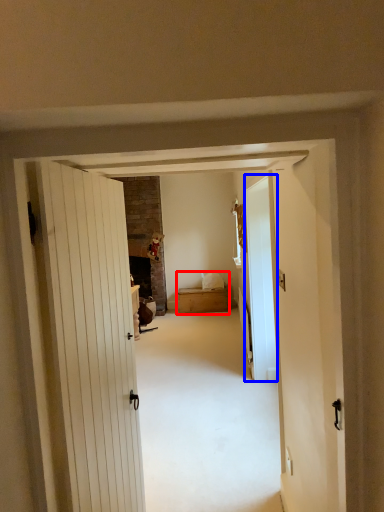
Question: Among these objects, which one is farthest to the camera, bed (highlighted by a red box) or glass door (highlighted by a blue box)?

Choices:
 (A) bed
 (B) glass door

Answer: (A)